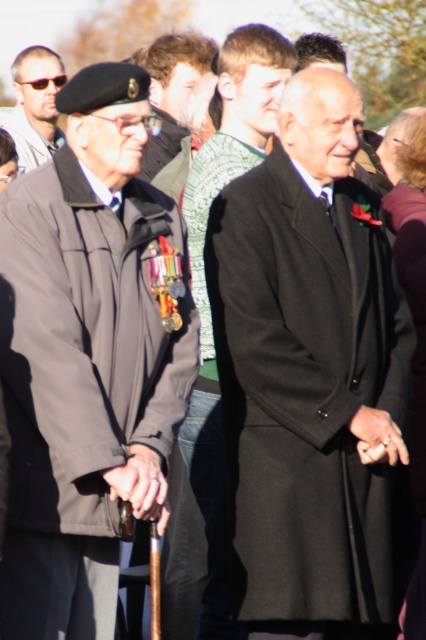
You are a photographer at the event and want to capture a clear photo of both the matte black jacket at left and the matte black sunglasses at upper left. Which object should you focus on first to ensure both are in focus?

You should focus on the matte black jacket at left first because it is closer to the camera than the matte black sunglasses at upper left. By focusing on the closer object, the depth of field may also keep the sunglasses in acceptable focus, but prioritizing the jacket ensures its clarity.

You are standing in front of the two men in the image. You want to place a small flower bouquet between them. Which point, point A at coordinates point (264, 634) or point B at coordinates point (54, 145), is closer to you and thus better for placing the bouquet so it appears centered in the photo?

Point A at coordinates point (264, 634) is closer to the viewer than point B at coordinates point (54, 145), so placing the bouquet there would make it appear centered in the photo.

You are a photographer at a formal event and need to arrange the two men in the image so that their coats do not overlap. Given the current positions of the black wool coat at center and the dark gray wool coat at center, which coat should be moved to the left to prevent overlapping?

The black wool coat at center should be moved to the left to prevent overlapping since it is currently positioned on the right side of the dark gray wool coat at center.